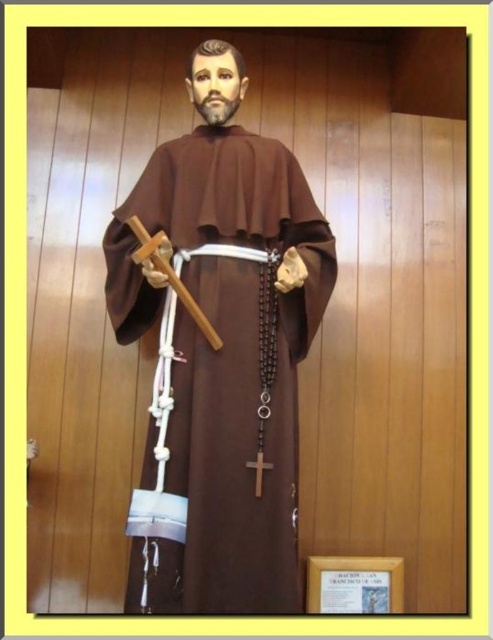
Which of these two, brown matte robe at center or wooden cross at center, stands taller?

Standing taller between the two is brown matte robe at center.

Which is above, brown matte robe at center or wooden cross at center?

brown matte robe at center is higher up.

Does point (246, 192) lie in front of point (248, 467)?

No.

Locate an element on the screen. The height and width of the screenshot is (640, 493). brown matte robe at center is located at coordinates (218, 353).